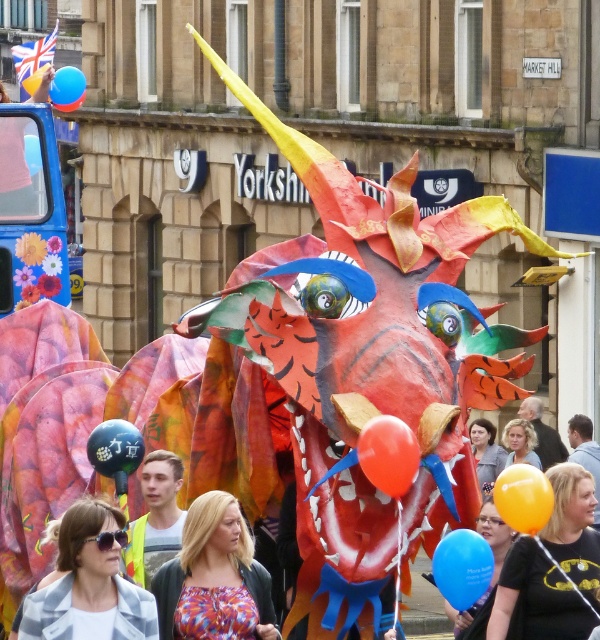
Question: Which of the following is the farthest from the observer?

Choices:
 (A) yellow reflective vest at center
 (B) blue glossy balloon at upper left
 (C) rubber balloon at center
 (D) orange glossy balloon at center

Answer: (B)

Question: Can you confirm if multicolored fabric at center is smaller than orange glossy balloon at center?

Choices:
 (A) yes
 (B) no

Answer: (B)

Question: Is the position of batman t-shirt at lower right more distant than that of matte blue balloon at lower center?

Choices:
 (A) yes
 (B) no

Answer: (A)

Question: Which of these objects is positioned farthest from the yellow reflective vest at center?

Choices:
 (A) multicolored fabric at center
 (B) translucent blue balloon at upper left
 (C) matte blue balloon at lower center
 (D) matte black balloon at center

Answer: (B)

Question: From the image, what is the correct spatial relationship of batman t-shirt at lower right in relation to translucent blue balloon at upper left?

Choices:
 (A) left
 (B) right

Answer: (B)

Question: Which object is positioned farthest from the yellow reflective vest at center?

Choices:
 (A) blue glossy balloon at lower center
 (B) batman t-shirt at lower right
 (C) multicolored fabric at center
 (D) rubber balloon at center

Answer: (D)